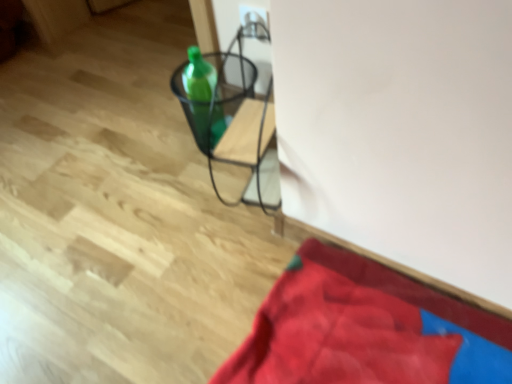
Question: Is velvety red blanket at lower right outside of green glass bottle at center?

Choices:
 (A) yes
 (B) no

Answer: (A)

Question: Can you confirm if velvety red blanket at lower right is taller than green glass bottle at center?

Choices:
 (A) yes
 (B) no

Answer: (B)

Question: Does velvety red blanket at lower right have a greater width compared to green glass bottle at center?

Choices:
 (A) no
 (B) yes

Answer: (B)

Question: Is velvety red blanket at lower right further to the viewer compared to green glass bottle at center?

Choices:
 (A) yes
 (B) no

Answer: (B)

Question: Considering the relative positions of velvety red blanket at lower right and green glass bottle at center in the image provided, is velvety red blanket at lower right to the left of green glass bottle at center from the viewer's perspective?

Choices:
 (A) no
 (B) yes

Answer: (A)

Question: Is velvety red blanket at lower right to the right of green glass bottle at center from the viewer's perspective?

Choices:
 (A) no
 (B) yes

Answer: (B)

Question: Is green glass bottle at center to the left of velvety red blanket at lower right from the viewer's perspective?

Choices:
 (A) yes
 (B) no

Answer: (A)

Question: From the image's perspective, is green glass bottle at center above velvety red blanket at lower right?

Choices:
 (A) yes
 (B) no

Answer: (A)

Question: Is green glass bottle at center facing away from velvety red blanket at lower right?

Choices:
 (A) yes
 (B) no

Answer: (B)

Question: Would you say velvety red blanket at lower right is part of green glass bottle at center's contents?

Choices:
 (A) yes
 (B) no

Answer: (B)

Question: Is green glass bottle at center thinner than velvety red blanket at lower right?

Choices:
 (A) yes
 (B) no

Answer: (A)

Question: Are green glass bottle at center and velvety red blanket at lower right far apart?

Choices:
 (A) yes
 (B) no

Answer: (B)

Question: Could you tell me if metallic wire basket at center is turned towards green glass bottle at center?

Choices:
 (A) no
 (B) yes

Answer: (B)